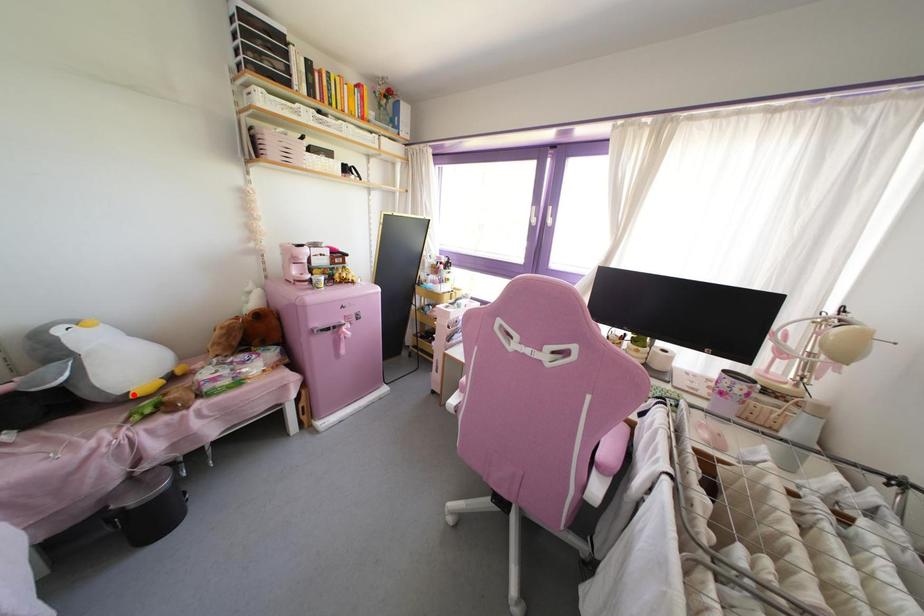
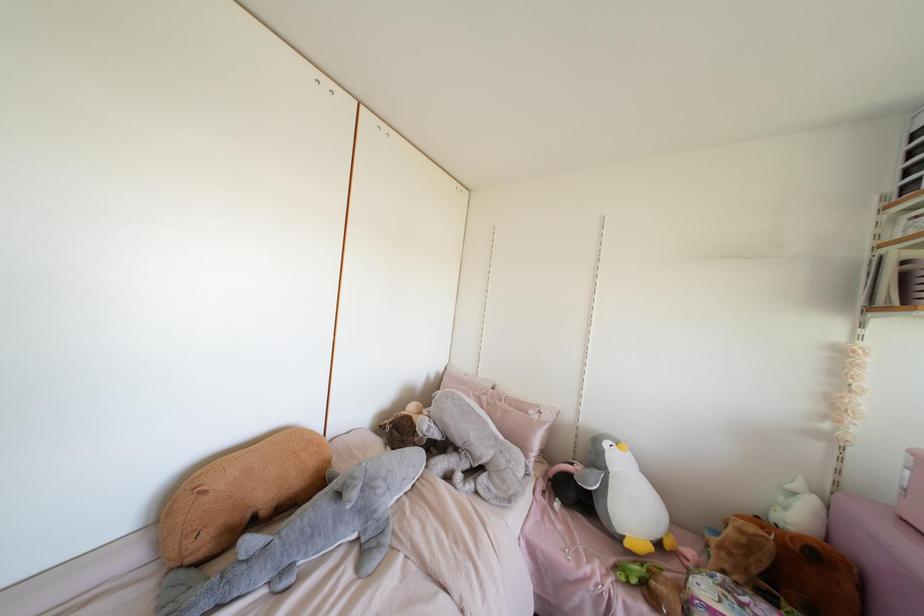
Question: I am providing you with two images of the same scene from different viewpoints. Image1 has a red point marked. In image2, the corresponding 3D location appears at what relative position? Reply with the corresponding letter.

Choices:
 (A) Closer
 (B) Farther

Answer: (B)